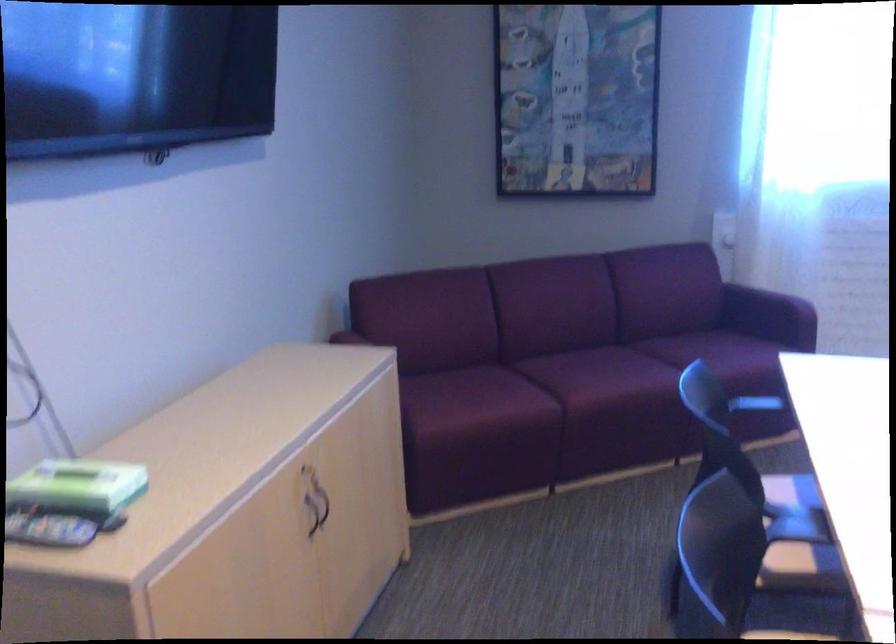
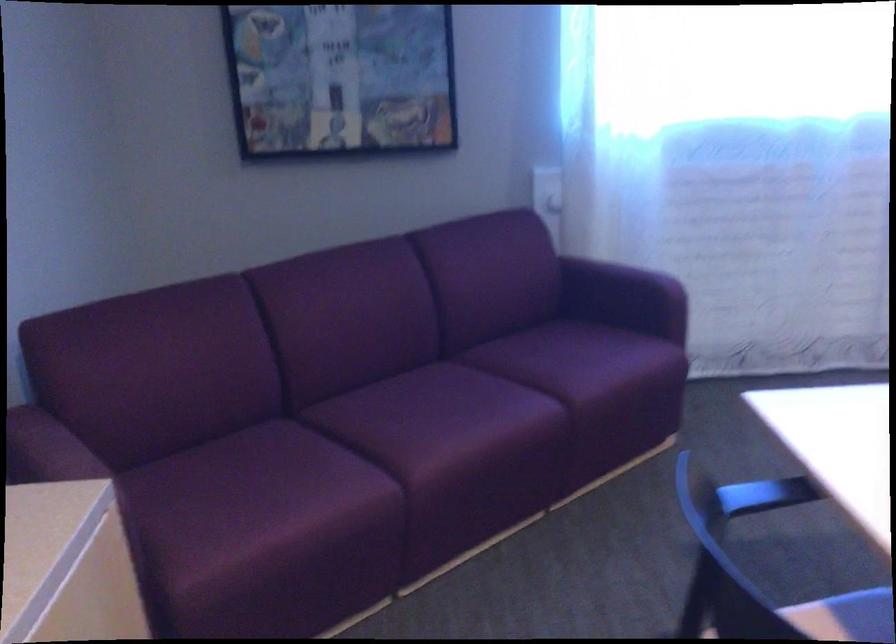
Find the pixel in the second image that matches point (725, 232) in the first image.

(547, 191)